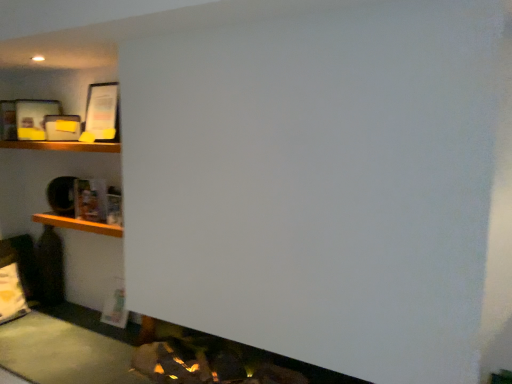
Question: From the image's perspective, is wooden shelf at left on top of wooden shelf at upper left?

Choices:
 (A) no
 (B) yes

Answer: (A)

Question: From the image's perspective, would you say wooden shelf at left is shown under wooden shelf at upper left?

Choices:
 (A) yes
 (B) no

Answer: (A)

Question: Is wooden shelf at left further to the viewer compared to wooden shelf at upper left?

Choices:
 (A) no
 (B) yes

Answer: (B)

Question: Does wooden shelf at left have a greater width compared to wooden shelf at upper left?

Choices:
 (A) no
 (B) yes

Answer: (A)

Question: Is wooden shelf at left not inside wooden shelf at upper left?

Choices:
 (A) no
 (B) yes

Answer: (B)

Question: From a real-world perspective, is wooden shelf at left under wooden shelf at upper left?

Choices:
 (A) no
 (B) yes

Answer: (B)

Question: Is wooden shelf at upper left not inside wooden shelf at left?

Choices:
 (A) yes
 (B) no

Answer: (A)

Question: Is wooden shelf at upper left positioned in front of wooden shelf at left?

Choices:
 (A) no
 (B) yes

Answer: (B)

Question: Is wooden shelf at upper left at the right side of wooden shelf at left?

Choices:
 (A) no
 (B) yes

Answer: (A)

Question: Does wooden shelf at upper left have a greater width compared to wooden shelf at left?

Choices:
 (A) yes
 (B) no

Answer: (A)

Question: Is wooden shelf at upper left not close to wooden shelf at left?

Choices:
 (A) yes
 (B) no

Answer: (B)

Question: From a real-world perspective, is wooden shelf at upper left located beneath wooden shelf at left?

Choices:
 (A) yes
 (B) no

Answer: (B)

Question: From the image's perspective, is wooden shelf at upper left positioned above or below wooden shelf at left?

Choices:
 (A) below
 (B) above

Answer: (B)